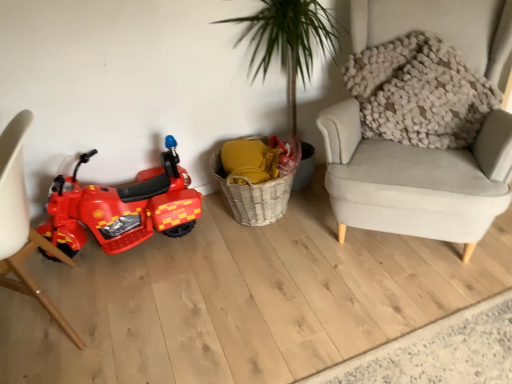
The height and width of the screenshot is (384, 512). Identify the location of vacant area that lies between matte white chair at left and woven basket at center. (192, 265).